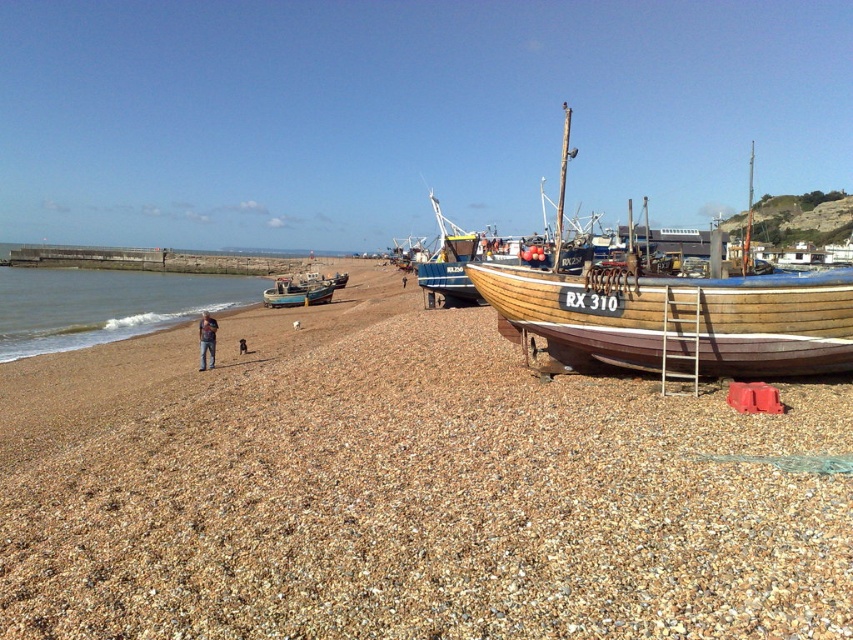
Which is below, wooden boat at right or denim pants at lower left?

denim pants at lower left is lower down.

Who is more distant from viewer, [730,348] or [202,321]?

The point [202,321] is more distant.

Who is more distant from viewer, [815,339] or [213,324]?

The point [213,324] is more distant.

Image resolution: width=853 pixels, height=640 pixels. In order to click on wooden boat at right in this screenshot , I will do `click(672, 314)`.

Does clear blue water at lower left appear over blue wooden boat at center?

Indeed, clear blue water at lower left is positioned over blue wooden boat at center.

Is clear blue water at lower left behind blue wooden boat at center?

No, clear blue water at lower left is closer to the viewer.

Does point (155, 323) lie in front of point (306, 298)?

Yes, point (155, 323) is closer to viewer.

The height and width of the screenshot is (640, 853). Find the location of `clear blue water at lower left`. clear blue water at lower left is located at coordinates (105, 305).

Is brown gravel at center bigger than clear blue water at lower left?

Incorrect, brown gravel at center is not larger than clear blue water at lower left.

Between brown gravel at center and clear blue water at lower left, which one has more height?

clear blue water at lower left is taller.

Between point (753, 492) and point (218, 304), which one is positioned in front?

Point (753, 492) is more forward.

I want to click on brown gravel at center, so click(404, 490).